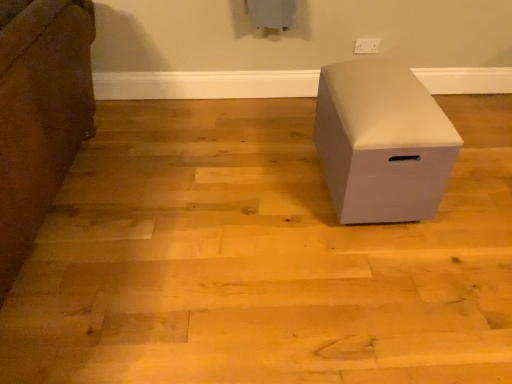
Question: Can you confirm if white plastic electric outlet at upper center is bigger than white matte storage box at center, which is the 1th furniture from left to right?

Choices:
 (A) no
 (B) yes

Answer: (A)

Question: Are white plastic electric outlet at upper center and white matte storage box at center, which is the 1th furniture from left to right, beside each other?

Choices:
 (A) no
 (B) yes

Answer: (A)

Question: From the image's perspective, is white plastic electric outlet at upper center under white matte storage box at center, which is the second furniture in right-to-left order?

Choices:
 (A) no
 (B) yes

Answer: (A)

Question: Is white plastic electric outlet at upper center positioned behind white matte storage box at center, which is the 1th furniture from left to right?

Choices:
 (A) yes
 (B) no

Answer: (A)

Question: Is white plastic electric outlet at upper center far away from white matte storage box at center, which is the second furniture in right-to-left order?

Choices:
 (A) no
 (B) yes

Answer: (B)

Question: In terms of width, does white matte storage box at center, which is the second furniture in right-to-left order, look wider or thinner when compared to white plastic electric outlet at upper center?

Choices:
 (A) wide
 (B) thin

Answer: (A)

Question: Considering the positions of point (55, 64) and point (371, 48), is point (55, 64) closer or farther from the camera than point (371, 48)?

Choices:
 (A) closer
 (B) farther

Answer: (A)

Question: Considering the relative positions of white matte storage box at center, which is the 1th furniture from left to right, and white plastic electric outlet at upper center in the image provided, is white matte storage box at center, which is the 1th furniture from left to right, to the left or to the right of white plastic electric outlet at upper center?

Choices:
 (A) left
 (B) right

Answer: (A)

Question: From a real-world perspective, is white matte storage box at center, which is the 1th furniture from left to right, physically located above or below white plastic electric outlet at upper center?

Choices:
 (A) above
 (B) below

Answer: (A)

Question: In the image, is white matte storage box at center, the 2th furniture in the left-to-right sequence, positioned in front of or behind white plastic electric outlet at upper center?

Choices:
 (A) behind
 (B) front

Answer: (B)

Question: Looking at their shapes, would you say white matte storage box at center, the 2th furniture in the left-to-right sequence, is wider or thinner than white plastic electric outlet at upper center?

Choices:
 (A) wide
 (B) thin

Answer: (A)

Question: Would you say white matte storage box at center, the 2th furniture in the left-to-right sequence, is to the left or to the right of white plastic electric outlet at upper center in the picture?

Choices:
 (A) left
 (B) right

Answer: (A)

Question: From a real-world perspective, is white matte storage box at center, positioned as the first furniture in right-to-left order, positioned above or below white plastic electric outlet at upper center?

Choices:
 (A) above
 (B) below

Answer: (B)

Question: From a real-world perspective, relative to white matte storage box at center, which is the second furniture in right-to-left order, is white plastic electric outlet at upper center vertically above or below?

Choices:
 (A) above
 (B) below

Answer: (B)

Question: Considering the positions of point (357, 44) and point (2, 253), is point (357, 44) closer or farther from the camera than point (2, 253)?

Choices:
 (A) farther
 (B) closer

Answer: (A)